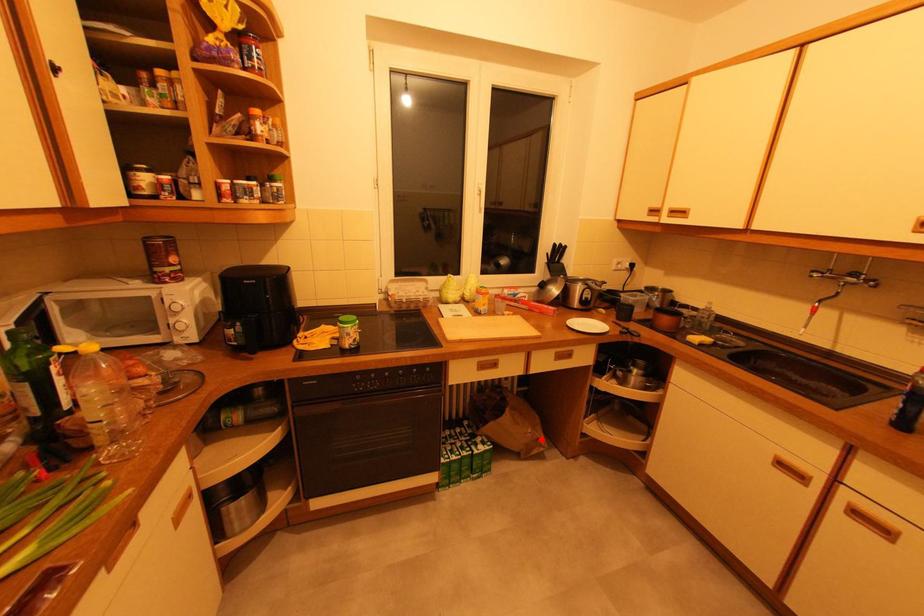
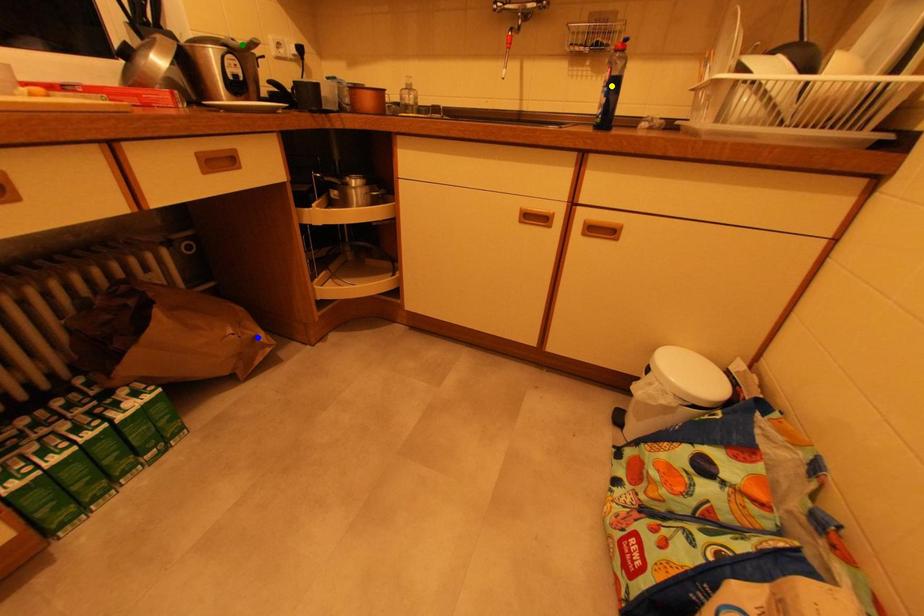
Question: I am providing you with two images of the same scene from different viewpoints. A red point is marked on the first image. You are given multiple points on the second image. Which point in image 2 represents the same 3d spot as the red point in image 1?

Choices:
 (A) green point
 (B) blue point
 (C) yellow point

Answer: (B)